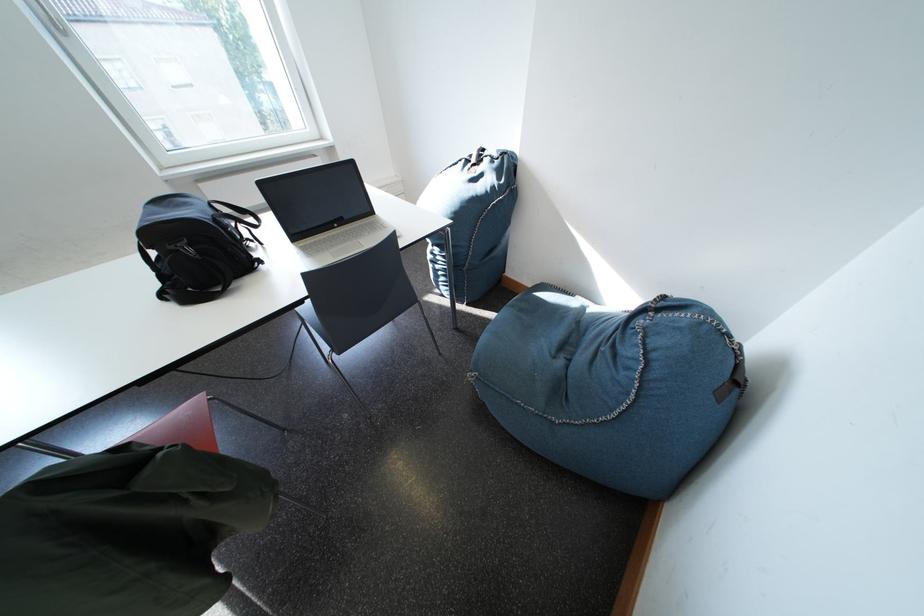
Identify the location of black backpack handle. The height and width of the screenshot is (616, 924). 235,214.